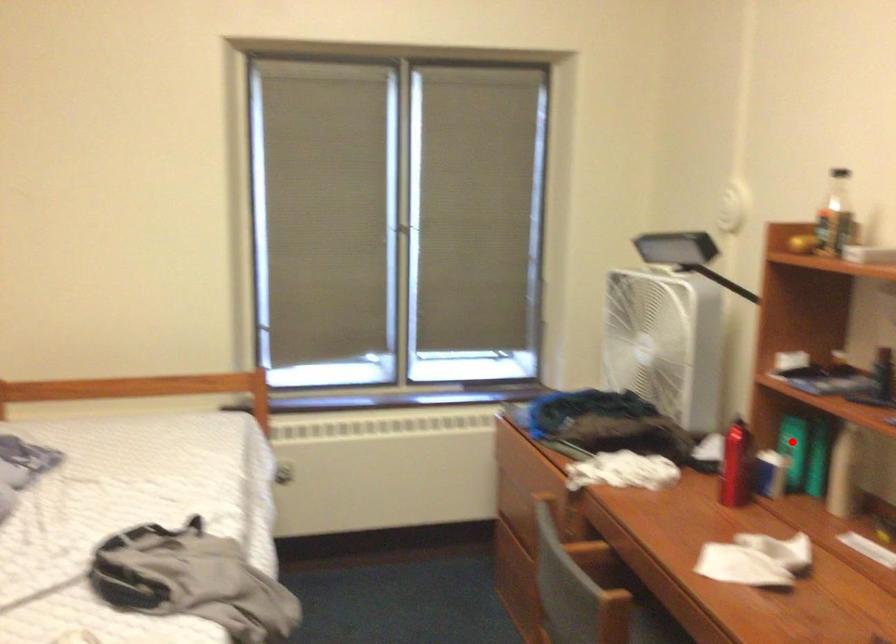
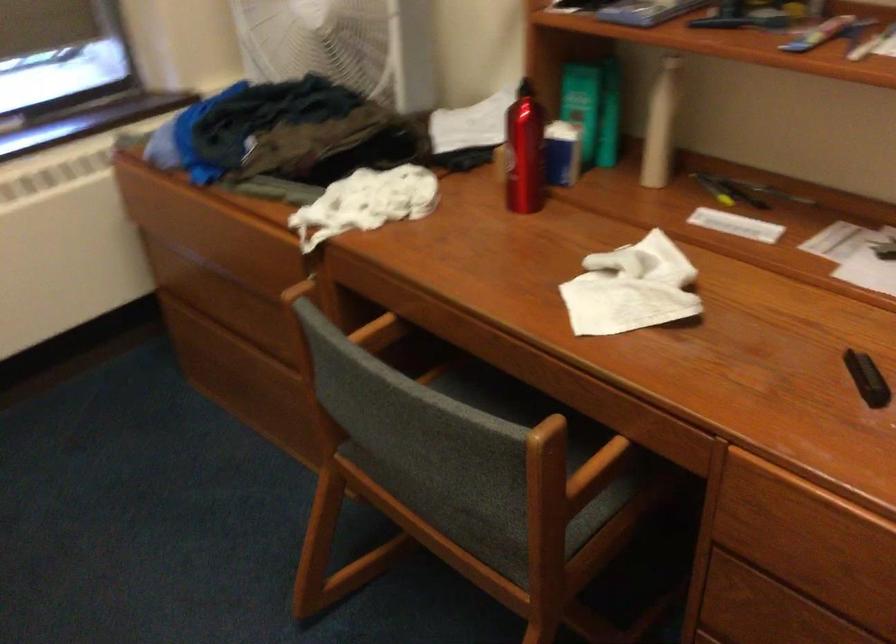
In the second image, find the point that corresponds to the highlighted location in the first image.

(582, 104)